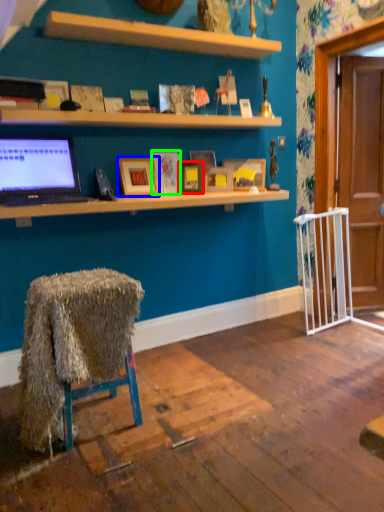
Question: Based on their relative distances, which object is nearer to picture frame (highlighted by a red box)? Choose from picture frame (highlighted by a blue box) and picture frame (highlighted by a green box).

Choices:
 (A) picture frame
 (B) picture frame

Answer: (B)